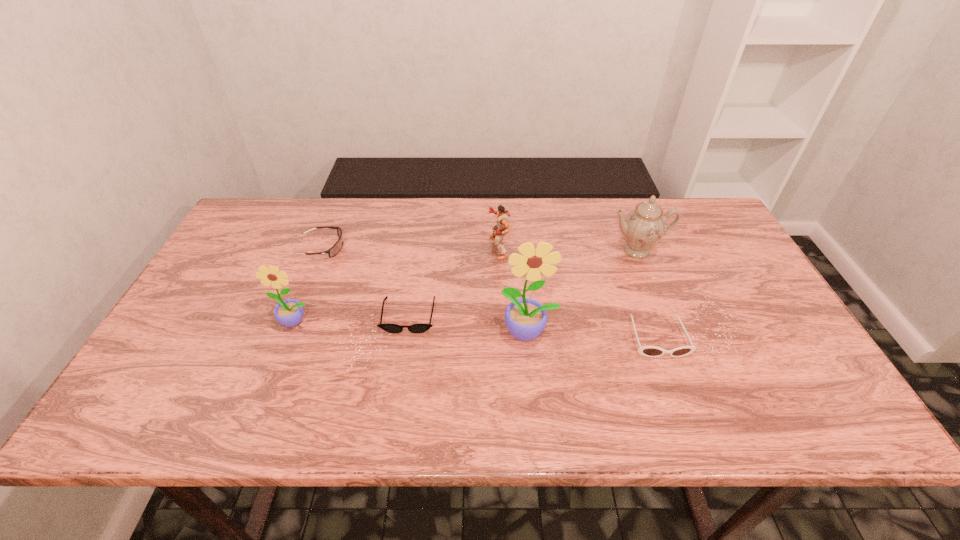
Where is `vacant point at the far edge`? This screenshot has width=960, height=540. vacant point at the far edge is located at coordinates (375, 207).

Find the location of a particular element. vacant position at the near edge of the desktop is located at coordinates (302, 381).

Locate an element on the screen. Image resolution: width=960 pixels, height=540 pixels. vacant space at the left edge of the desktop is located at coordinates (238, 304).

Image resolution: width=960 pixels, height=540 pixels. In the image, there is a desktop. What are the coordinates of `free space at the right edge` in the screenshot? It's located at (759, 305).

The height and width of the screenshot is (540, 960). What are the coordinates of `vacant space at the far left corner` in the screenshot? It's located at (278, 205).

The width and height of the screenshot is (960, 540). In the image, there is a desktop. Find the location of `vacant space at the near left corner`. vacant space at the near left corner is located at coordinates (184, 364).

The width and height of the screenshot is (960, 540). I want to click on free space at the far right corner of the desktop, so pyautogui.click(x=691, y=209).

Locate an element on the screen. The image size is (960, 540). empty space between the goggles and the taller sunglasses is located at coordinates coord(490,292).

At what (x,y) coordinates should I click in order to perform the action: click on free point between the right sunglasses and the chinaware. Please return your answer as a coordinate pair (x, y). This screenshot has height=540, width=960. Looking at the image, I should click on (647, 294).

You are a GUI agent. You are given a task and a screenshot of the screen. Output one action in this format:
    pyautogui.click(x=<x>, y=<y>)
    Task: Click on the free spot between the chinaware and the right sunglasses
    This screenshot has width=960, height=540.
    Given the screenshot: What is the action you would take?
    pyautogui.click(x=647, y=294)